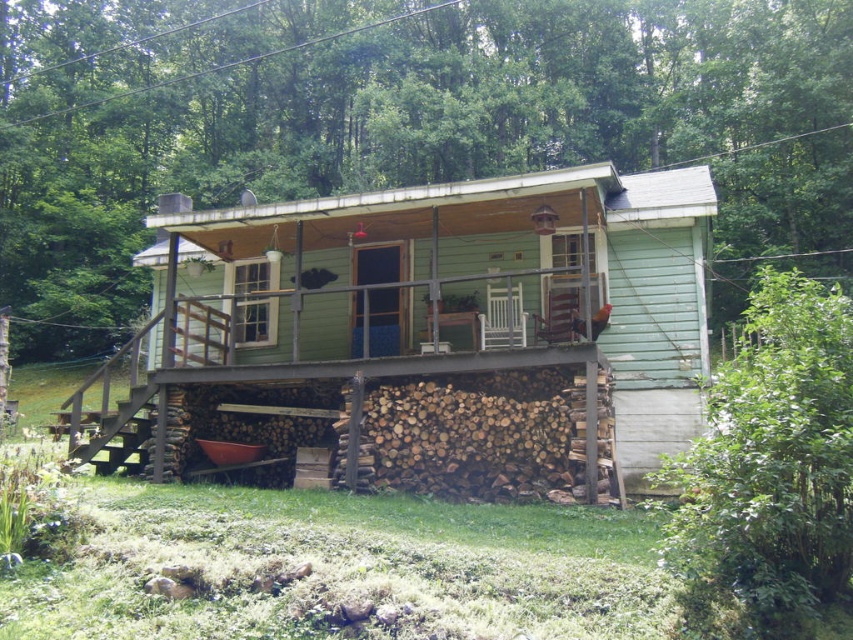
Between green wooden cabin at center and green wooden porch at center, which one has less height?

With less height is green wooden cabin at center.

Can you confirm if green wooden cabin at center is smaller than green wooden porch at center?

Indeed, green wooden cabin at center has a smaller size compared to green wooden porch at center.

Describe the element at coordinates (431, 332) in the screenshot. I see `green wooden cabin at center` at that location.

Where is `green wooden cabin at center`? Image resolution: width=853 pixels, height=640 pixels. green wooden cabin at center is located at coordinates (431, 332).